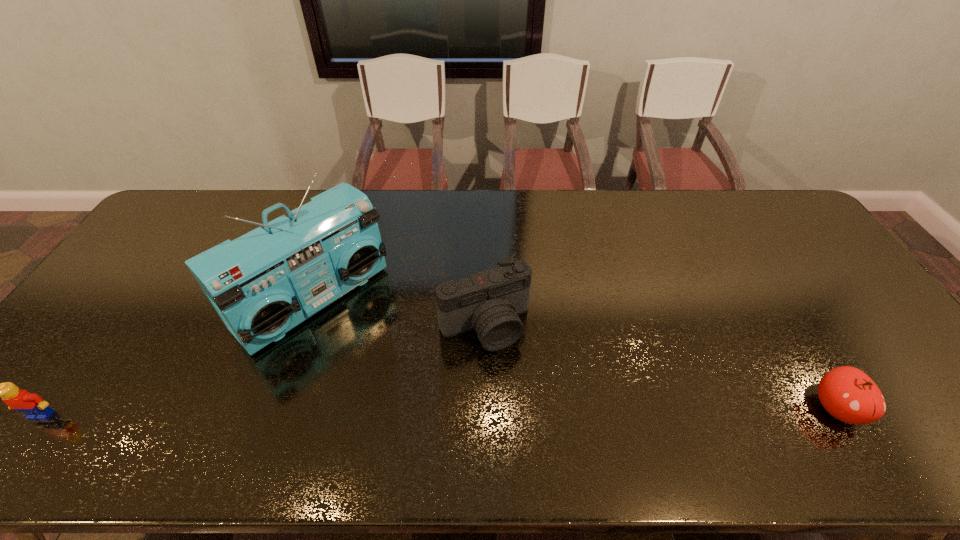
The width and height of the screenshot is (960, 540). I want to click on vacant spot on the desktop that is between the leftmost object and the apple and is positioned on the front-facing side of the radio receiver, so click(436, 411).

I want to click on vacant space on the desktop that is between the Lego and the rightmost object and is positioned at the lens of the second tallest object, so click(529, 411).